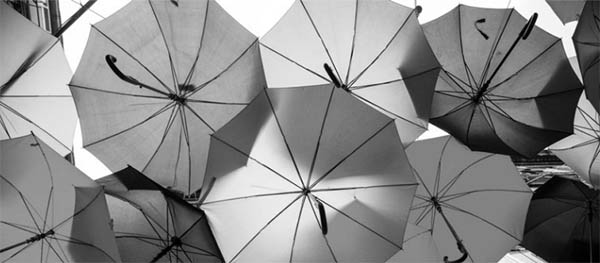
At what (x,y) coordinates should I click in order to perform the action: click on left window pane. Please return your answer as a coordinate pair (x, y). This screenshot has width=600, height=263. Looking at the image, I should click on (35, 15).